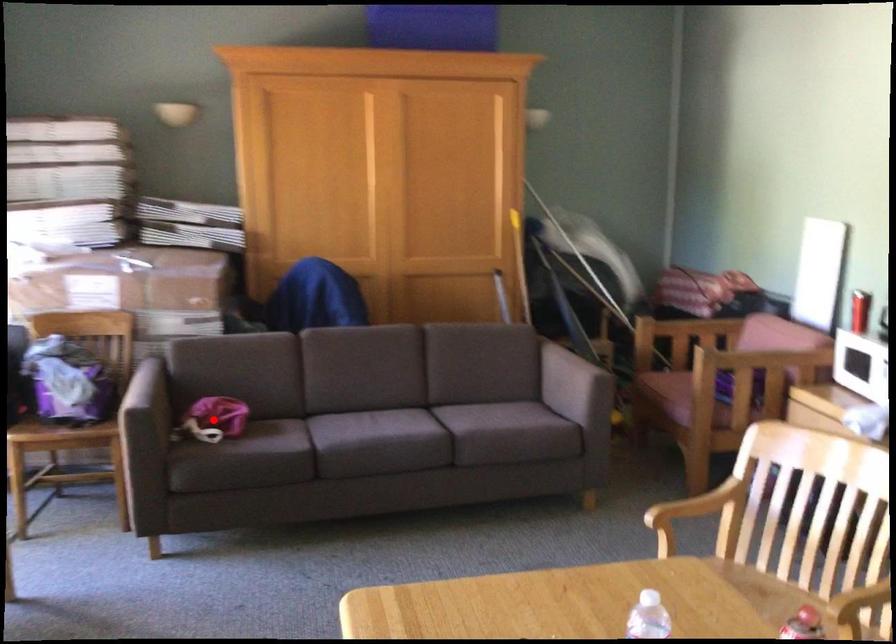
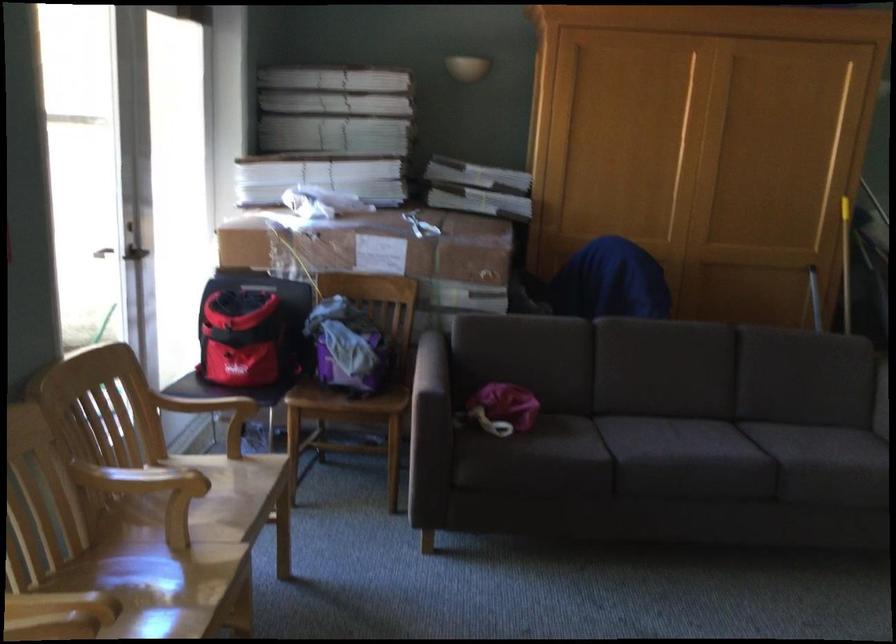
Find the pixel in the second image that matches the highlighted location in the first image.

(503, 408)